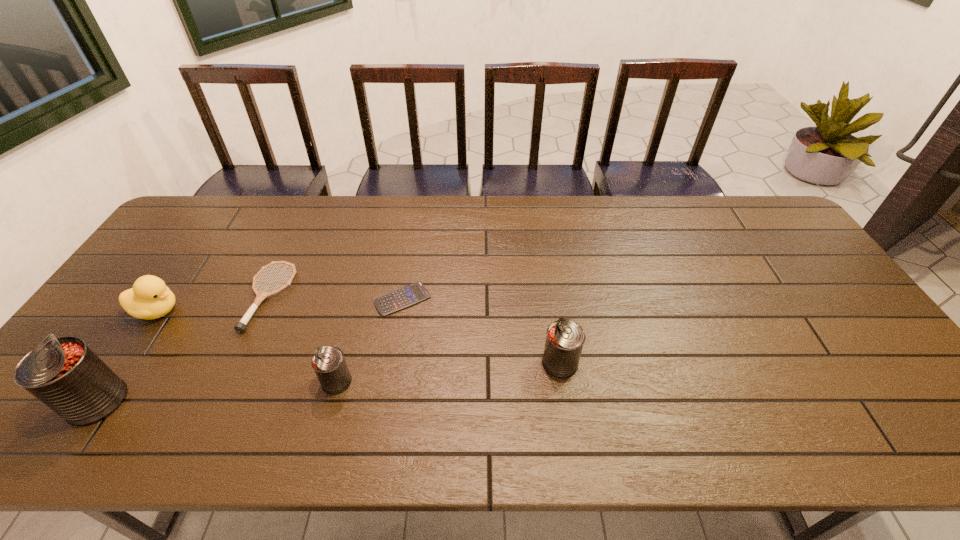
Find the location of a particular element. vacant space at the far edge is located at coordinates (576, 212).

This screenshot has height=540, width=960. I want to click on free space at the near edge of the desktop, so click(x=478, y=380).

The image size is (960, 540). I want to click on free space at the left edge of the desktop, so click(x=197, y=256).

In the image, there is a desktop. Find the location of `vacant region at the right edge`. vacant region at the right edge is located at coordinates (786, 251).

In the image, there is a desktop. Find the location of `vacant space at the far left corner`. vacant space at the far left corner is located at coordinates (241, 197).

The height and width of the screenshot is (540, 960). I want to click on vacant space at the far right corner, so click(759, 205).

What are the coordinates of `free spot between the fifth tallest object and the fifth object from left to right` in the screenshot? It's located at (336, 298).

You are a GUI agent. You are given a task and a screenshot of the screen. Output one action in this format:
    pyautogui.click(x=<x>, y=<y>)
    Task: Click on the vacant space that is in between the tallest can and the second can from right to left
    
    Given the screenshot: What is the action you would take?
    pyautogui.click(x=217, y=392)

Where is `free space between the second can from left to right and the fourth object from right to left`? free space between the second can from left to right and the fourth object from right to left is located at coordinates click(x=302, y=339).

Locate an element on the screen. The width and height of the screenshot is (960, 540). free space between the tennis racket and the fifth object from left to right is located at coordinates (336, 298).